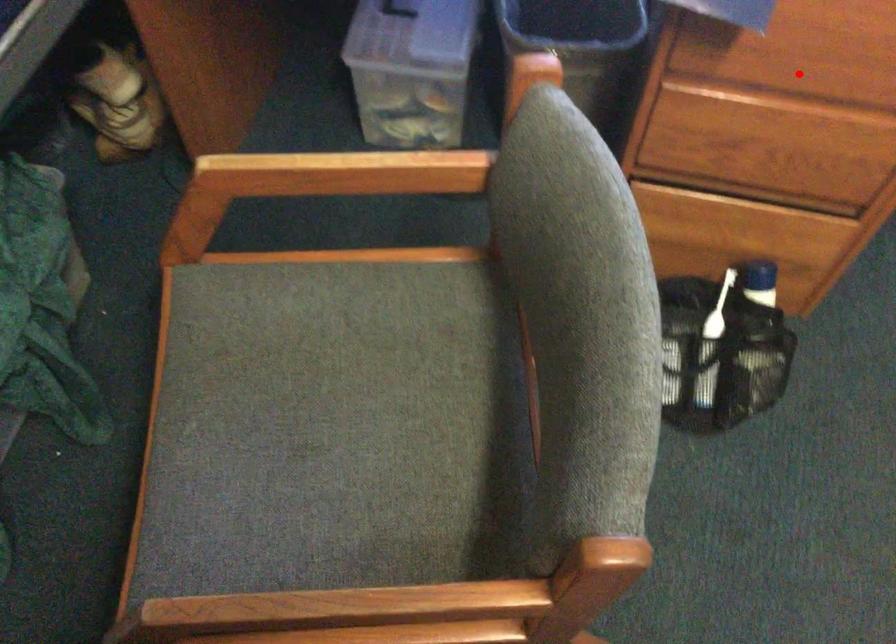
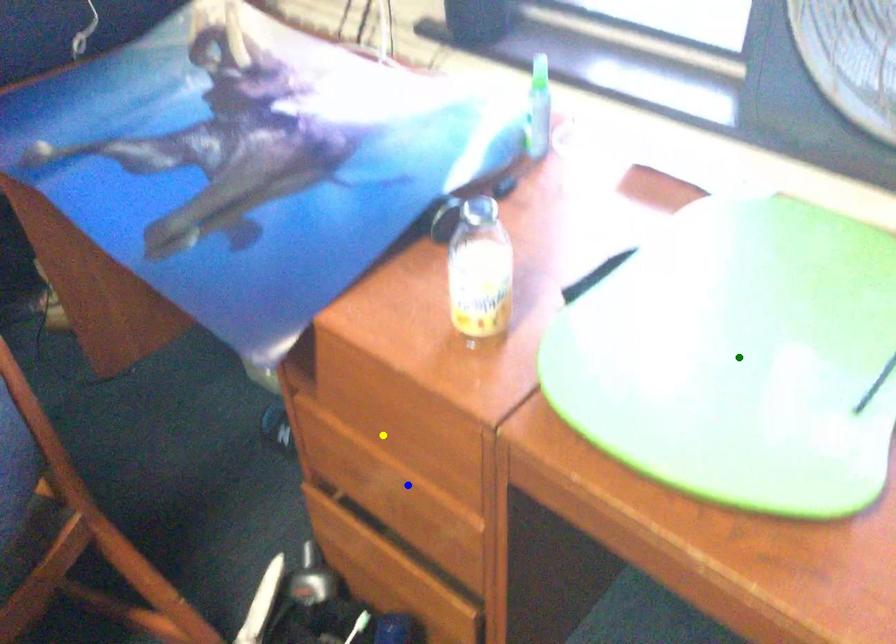
Question: I am providing you with two images of the same scene from different viewpoints. A red point is marked on the first image. You are given multiple points on the second image. Which point in image 2 represents the same 3d spot as the red point in image 1?

Choices:
 (A) blue point
 (B) green point
 (C) yellow point

Answer: (C)